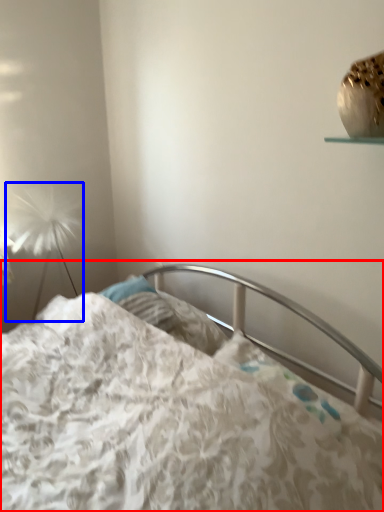
Question: Which object appears farthest to the camera in this image, bed (highlighted by a red box) or lamp (highlighted by a blue box)?

Choices:
 (A) bed
 (B) lamp

Answer: (B)